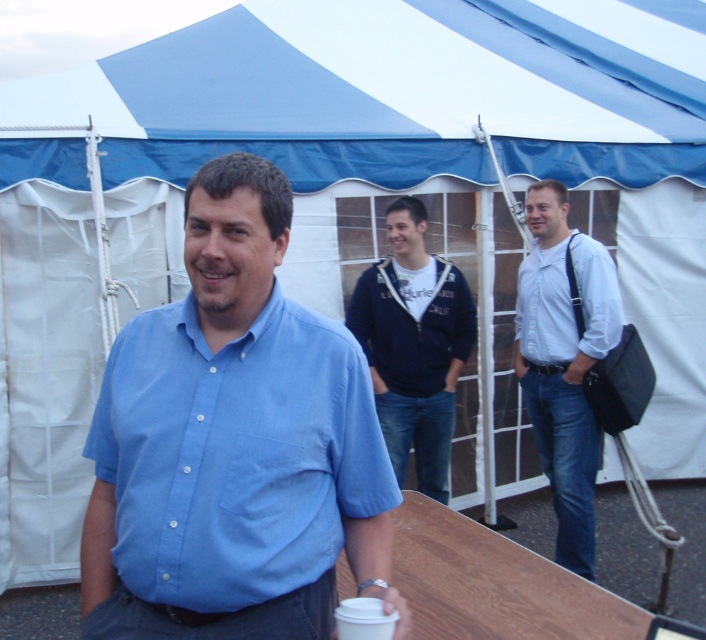
Based on the photo, is matte blue shirt at center further to the viewer compared to white paper cup at lower center?

Yes, matte blue shirt at center is further from the viewer.

Who is positioned more to the right, matte blue shirt at center or white paper cup at lower center?

white paper cup at lower center

This screenshot has height=640, width=706. What do you see at coordinates (233, 444) in the screenshot?
I see `matte blue shirt at center` at bounding box center [233, 444].

Find the location of a particular element. matte blue shirt at center is located at coordinates (233, 444).

Who is more forward, (534, 301) or (436, 394)?

Point (534, 301) is in front.

I want to click on white shirt at right, so pos(563,362).

Who is more distant from viewer, (633, 637) or (385, 620)?

Point (633, 637)

At what (x,y) coordinates should I click in order to perform the action: click on wooden table at lower center. Please return your answer as a coordinate pair (x, y). Looking at the image, I should click on coord(493,582).

The height and width of the screenshot is (640, 706). What are the coordinates of `wooden table at lower center` in the screenshot? It's located at (493, 582).